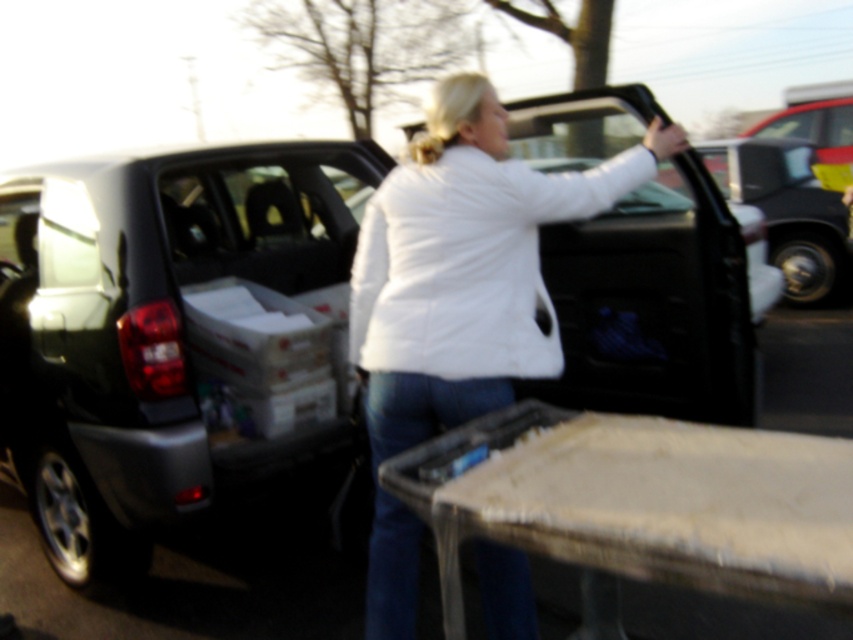
You are standing at a distance and want to place a 10 feet long ladder in front of the metallic gray car at center. Can you fit the ladder horizontally in front of it without moving the car?

The metallic gray car at center is 9.22 feet away from the viewer. Since the ladder is 10 feet long, it would extend beyond the car, so it might not fit horizontally without overlapping or moving the car.

You are trying to determine if the metallic gray car at center can fit through a narrow alleyway that is only as wide as the white puffy jacket at center. Based on the scene, can the car pass through?

The metallic gray car at center is wider than the white puffy jacket at center, so it cannot fit through an alleyway as narrow as the jacket.

You are standing at the center of the image. Which direction should you move to reach the metallic gray car at center?

Since the metallic gray car at center is already at the center of the image, you don not need to move in any direction to reach it.